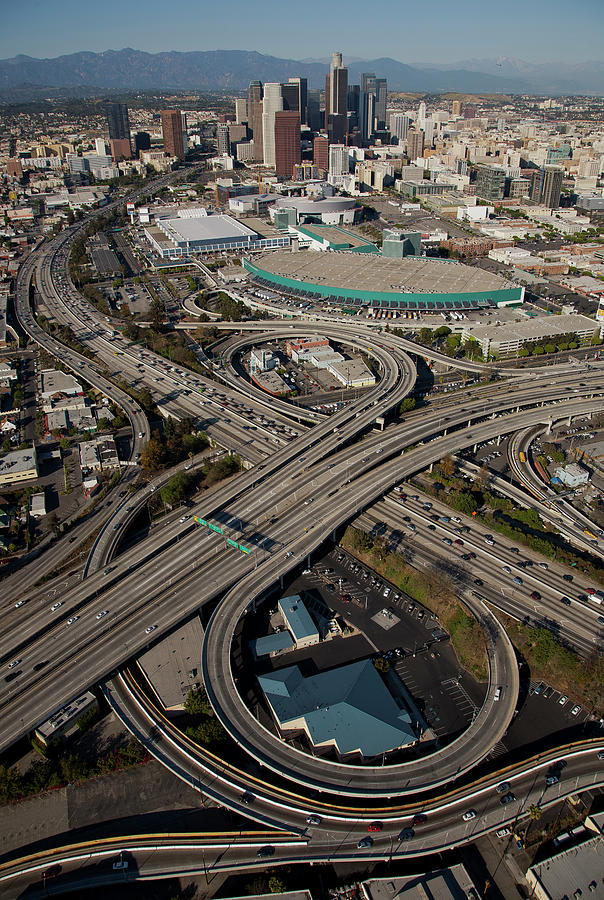
The width and height of the screenshot is (604, 900). What are the coordinates of `blue walls` in the screenshot? It's located at (374, 248), (312, 237), (254, 268), (291, 286), (339, 294), (400, 295), (487, 299).